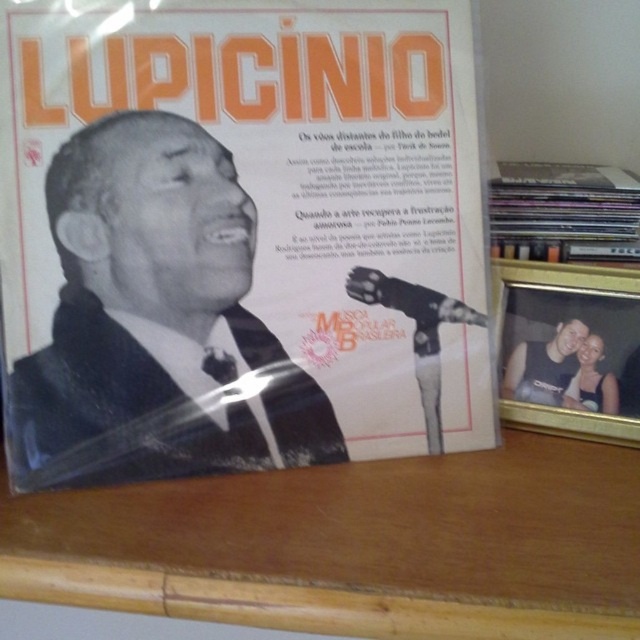
You are a tailor measuring the distance between the matte black suit at center and the matte black tank top at lower right for a custom fitting. The minimum distance required for accurate measurements is 12 inches. Can you perform the measurement accurately?

The matte black suit at center is 12.27 inches away from the matte black tank top at lower right, which meets the minimum requirement of 12 inches. Therefore, the tailor can perform the measurement accurately.

You are a collector examining the vinyl record cover. You notice the matte black suit at center and the matte black vinyl records at upper right. Which object appears nearer to you on the cover?

The matte black suit at center appears nearer to you because it is closer to the viewer than the matte black vinyl records at upper right.